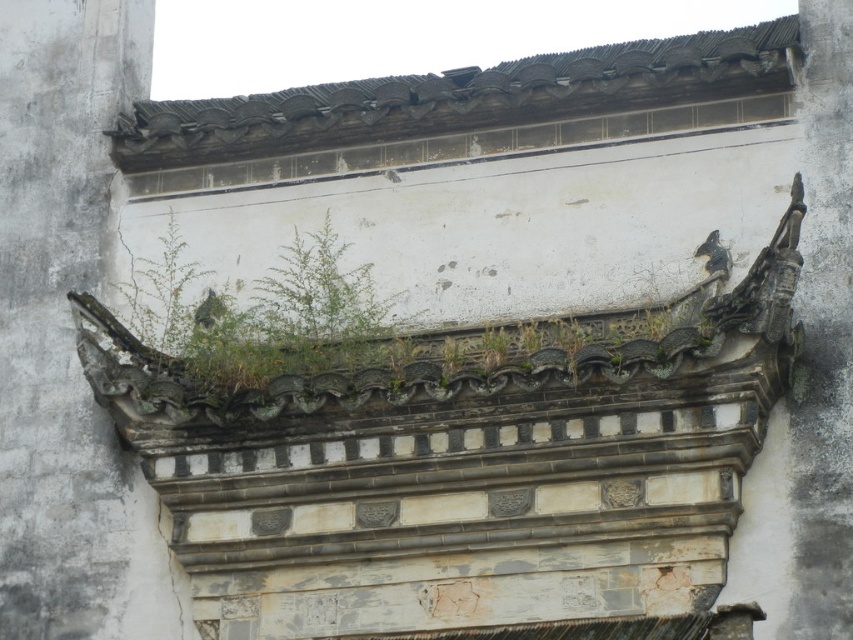
You are standing in front of the aged architectural structure. You notice two points marked on the image. The first point is at coordinate point (39, 364) and the second is at point (801, 76). Which point is closer to you?

Point (801, 76) is closer to you because it is in front of point (39, 364).

You are a maintenance worker inspecting the roof of this traditional building. You notice the rusty stone gargoyle at upper center and the dark gray stone dragon at upper right. Which of these two objects is positioned higher up on the structure?

The rusty stone gargoyle at upper center is positioned higher up on the structure than the dark gray stone dragon at upper right.

You are an architect assessing the structural integrity of the building. You notice the dark gray stone dragon at upper right and the green leafy plant at upper left. Which object could potentially cause more damage to the roof tiles over time due to its height?

The dark gray stone dragon at upper right is much taller than the green leafy plant at upper left, so it could potentially cause more damage to the roof tiles over time due to its height.